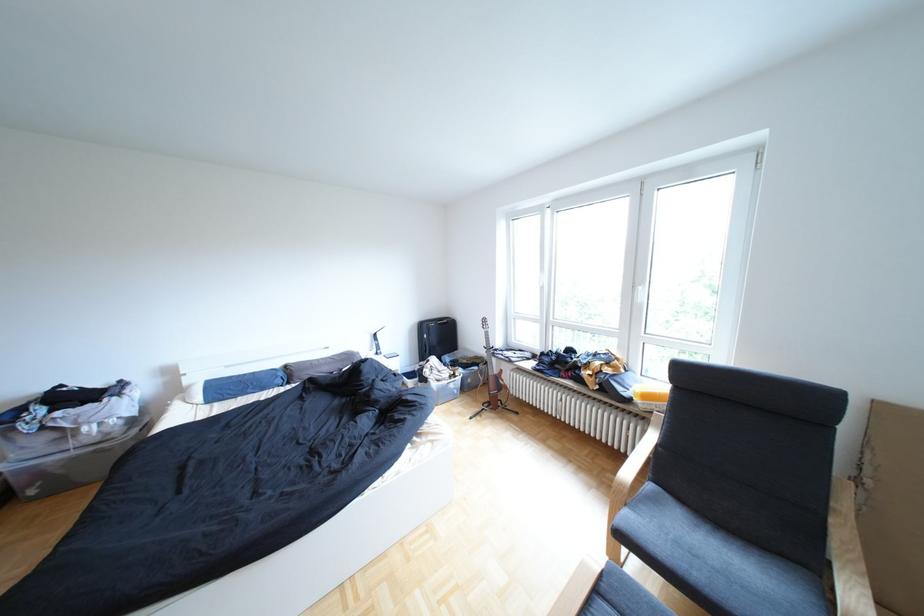
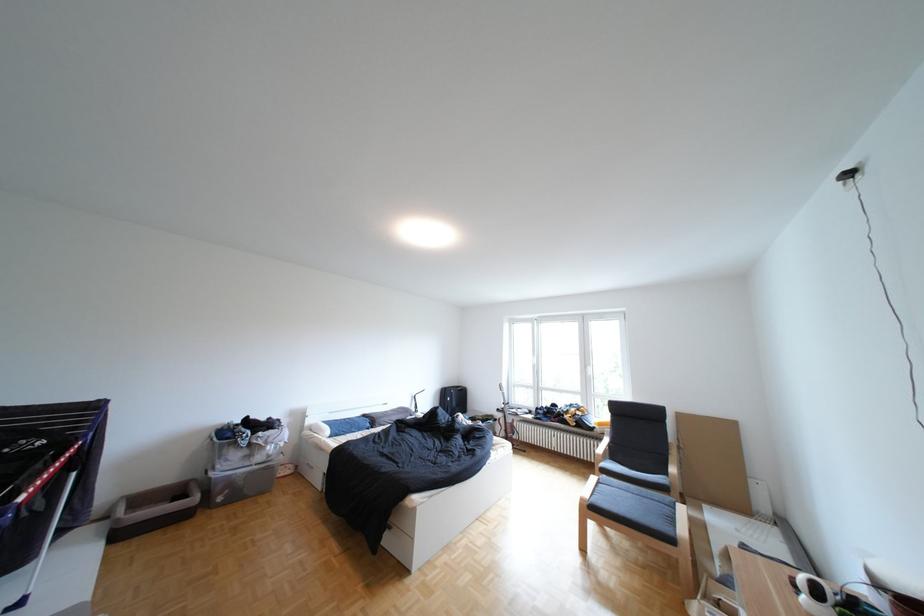
Where in the second image is the point corresponding to (67,411) from the first image?

(270, 434)